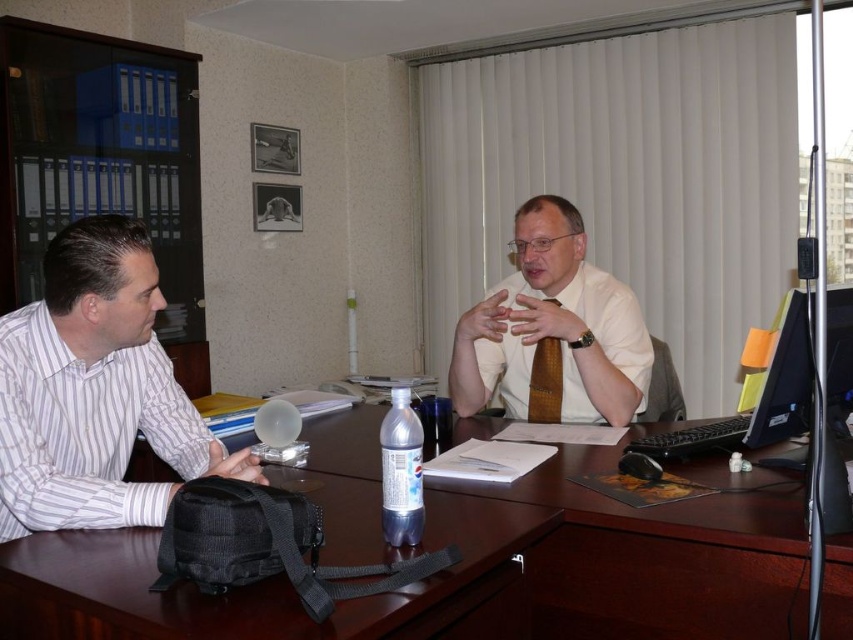
Is point (531, 412) behind point (552, 413)?

Yes.

Between point (637, 378) and point (527, 413), which one is positioned in front?

Point (637, 378) is more forward.

Between point (631, 360) and point (531, 404), which one is positioned behind?

The point (531, 404) is behind.

The width and height of the screenshot is (853, 640). Identify the location of white glossy shirt at center. (552, 330).

Can you confirm if striped cotton shirt at left is positioned to the right of black fabric bag at center?

No, striped cotton shirt at left is not to the right of black fabric bag at center.

Can you confirm if striped cotton shirt at left is positioned to the left of black fabric bag at center?

Correct, you'll find striped cotton shirt at left to the left of black fabric bag at center.

Is point (239, 452) more distant than point (28, 588)?

Yes, point (239, 452) is farther from viewer.

Where is `striped cotton shirt at left`? The height and width of the screenshot is (640, 853). striped cotton shirt at left is located at coordinates (94, 392).

Can you confirm if black matte bag at left is taller than black fabric bag at center?

Correct, black matte bag at left is much taller as black fabric bag at center.

Measure the distance from black matte bag at left to black fabric bag at center.

They are 3.23 inches apart.

What do you see at coordinates (461, 572) in the screenshot?
I see `black matte bag at left` at bounding box center [461, 572].

Identify the location of black matte bag at left. (461, 572).